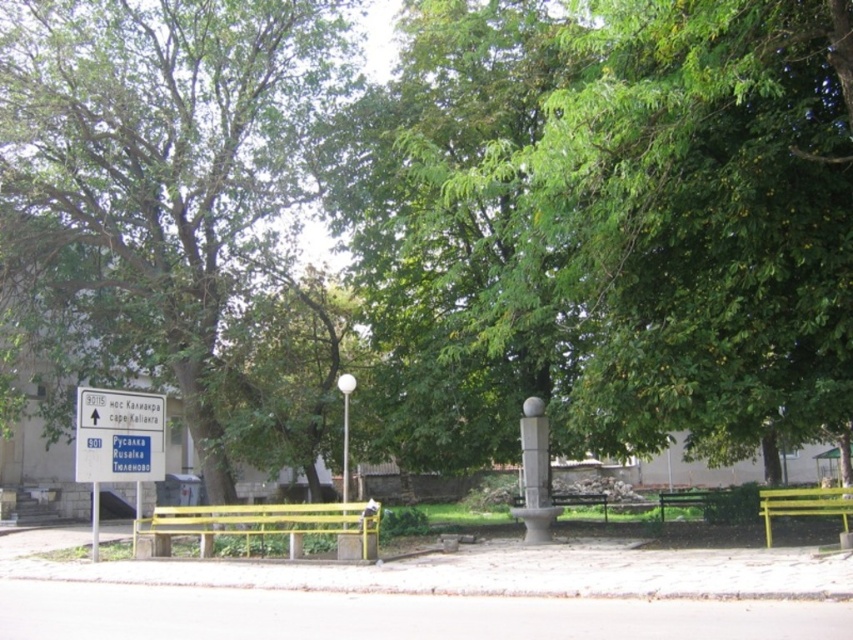
Between yellow painted wood bench at center and white plastic sign at left, which one appears on the left side from the viewer's perspective?

From the viewer's perspective, white plastic sign at left appears more on the left side.

Is yellow painted wood bench at center taller than white plastic sign at left?

Correct, yellow painted wood bench at center is much taller as white plastic sign at left.

Is point (349, 557) positioned before point (144, 420)?

That is True.

Locate an element on the screen. Image resolution: width=853 pixels, height=640 pixels. yellow painted wood bench at center is located at coordinates (262, 525).

Between green leafy tree at left and white plastic sign at left, which one has less height?

Standing shorter between the two is white plastic sign at left.

Identify the location of green leafy tree at left. This screenshot has width=853, height=640. (157, 163).

At what (x,y) coordinates should I click in order to perform the action: click on green leafy tree at left. Please return your answer as a coordinate pair (x, y). The width and height of the screenshot is (853, 640). Looking at the image, I should click on (157, 163).

Can you confirm if yellow painted wood bench at center is positioned below white plastic pole at lower left?

Indeed, yellow painted wood bench at center is positioned under white plastic pole at lower left.

Looking at this image, does yellow painted wood bench at center have a lesser width compared to white plastic pole at lower left?

No.

Between point (323, 518) and point (91, 486), which one is positioned in front?

Positioned in front is point (323, 518).

You are a GUI agent. You are given a task and a screenshot of the screen. Output one action in this format:
    pyautogui.click(x=<x>, y=<y>)
    Task: Click on the yellow painted wood bench at center
    This screenshot has width=853, height=640.
    Given the screenshot: What is the action you would take?
    pyautogui.click(x=262, y=525)